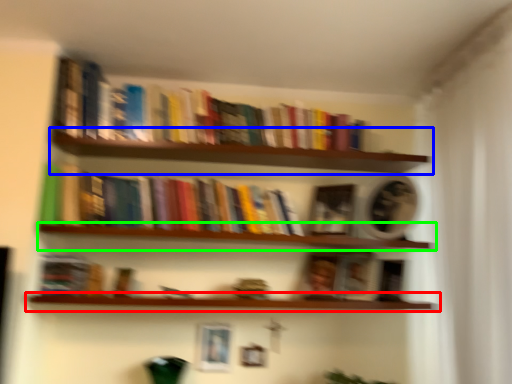
Question: Which object is positioned closest to window sill (highlighted by a red box)? Select from shelf (highlighted by a blue box) and window sill (highlighted by a green box).

Choices:
 (A) shelf
 (B) window sill

Answer: (B)